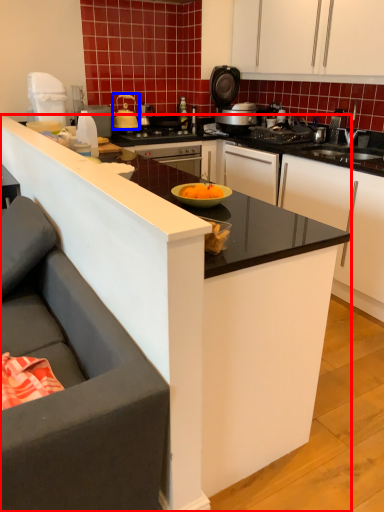
Question: Which object appears closest to the camera in this image, countertop (highlighted by a red box) or kitchen appliance (highlighted by a blue box)?

Choices:
 (A) countertop
 (B) kitchen appliance

Answer: (A)